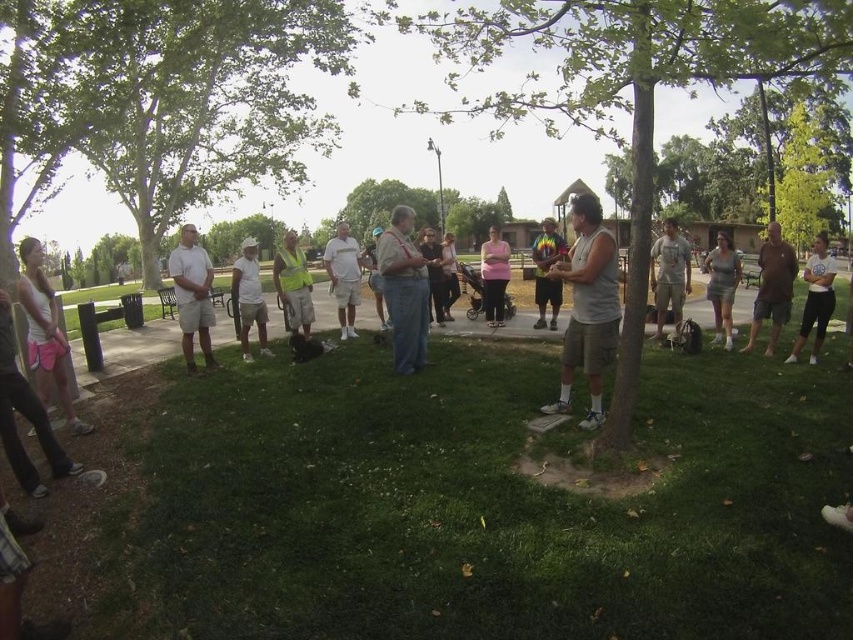
Question: Can you confirm if white cotton shirt at center is positioned below reflective yellow vest at center?

Choices:
 (A) no
 (B) yes

Answer: (B)

Question: Observing the image, what is the correct spatial positioning of gray sleeveless shirt at center in reference to matte gray shirt at center?

Choices:
 (A) above
 (B) below

Answer: (B)

Question: Which point is closer to the camera?

Choices:
 (A) (62, 352)
 (B) (669, 266)
 (C) (456, 278)

Answer: (A)

Question: Does green grass at lower center have a greater width compared to gray denim shorts at right?

Choices:
 (A) yes
 (B) no

Answer: (B)

Question: Which point is closer to the camera?

Choices:
 (A) reflective silver vest at center
 (B) green grass at lower center
 (C) gray denim shorts at right
 (D) pink fabric shorts at lower left

Answer: (B)

Question: Among these points, which one is farthest from the camera?

Choices:
 (A) (396, 308)
 (B) (231, 35)
 (C) (500, 298)
 (D) (281, 300)

Answer: (B)